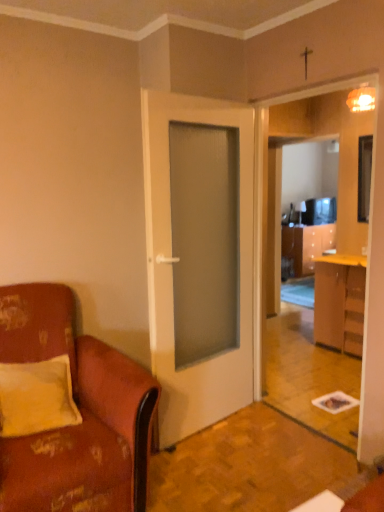
Measure the distance between point (50,403) and camera.

Point (50,403) and camera are 6.69 feet apart.

What do you see at coordinates (364, 176) in the screenshot?
I see `black glossy television at right` at bounding box center [364, 176].

Find the location of `white matte door at center`. white matte door at center is located at coordinates (171, 271).

Consider the image. Is yellow fabric pillow at left taller or shorter than black glossy television at right?

Clearly, yellow fabric pillow at left is shorter compared to black glossy television at right.

Is black glossy television at right at the back of yellow fabric pillow at left?

No.

Is yellow fabric pillow at left next to black glossy television at right and touching it?

No, yellow fabric pillow at left is not in contact with black glossy television at right.

How different are the orientations of yellow fabric pillow at left and black glossy television at right in degrees?

There is a 80.4-degree angle between the facing directions of yellow fabric pillow at left and black glossy television at right.

Are leather at left and wooden cabinet at right far apart?

Yes.

Is leather at left facing towards wooden cabinet at right?

No, leather at left is not facing towards wooden cabinet at right.

Between leather at left and wooden cabinet at right, which one has smaller width?

wooden cabinet at right.

Which of these two, leather at left or wooden cabinet at right, is smaller?

With smaller size is wooden cabinet at right.

Between black glossy television at right and yellow fabric pillow at left, which one appears on the right side from the viewer's perspective?

black glossy television at right is more to the right.

From the image's perspective, is black glossy television at right on yellow fabric pillow at left?

Yes.

Is there a large distance between black glossy television at right and yellow fabric pillow at left?

Indeed, black glossy television at right is not near yellow fabric pillow at left.

Which is more distant, (354,319) or (139,403)?

Positioned behind is point (354,319).

Does wooden cabinet at right have a greater width compared to leather at left?

No, wooden cabinet at right is not wider than leather at left.

Is wooden cabinet at right not within leather at left?

That's correct, wooden cabinet at right is outside of leather at left.

Identify the location of cabinetry on the right side of leather at left. (340, 302).

Is white matte door at center at the right side of wooden cabinet at right?

In fact, white matte door at center is to the left of wooden cabinet at right.

Is white matte door at center positioned with its back to wooden cabinet at right?

That's not correct — white matte door at center is not looking away from wooden cabinet at right.

From the image's perspective, which is below, white matte door at center or wooden cabinet at right?

wooden cabinet at right, from the image's perspective.

In terms of height, does white matte door at center look taller or shorter compared to wooden cabinet at right?

white matte door at center is taller than wooden cabinet at right.

Can you confirm if wooden cabinet at right is positioned to the left of yellow fabric pillow at left?

No.

Looking at this image, based on their sizes in the image, would you say wooden cabinet at right is bigger or smaller than yellow fabric pillow at left?

In the image, wooden cabinet at right appears to be larger than yellow fabric pillow at left.

Considering the relative sizes of wooden cabinet at right and yellow fabric pillow at left in the image provided, is wooden cabinet at right taller than yellow fabric pillow at left?

Indeed, wooden cabinet at right has a greater height compared to yellow fabric pillow at left.

Is wooden cabinet at right next to yellow fabric pillow at left?

No, wooden cabinet at right is not beside yellow fabric pillow at left.

Considering the sizes of objects black glossy television at right and white matte door at center in the image provided, who is bigger, black glossy television at right or white matte door at center?

white matte door at center is bigger.

Is black glossy television at right outside of white matte door at center?

That's correct, black glossy television at right is outside of white matte door at center.

Between black glossy television at right and white matte door at center, which one appears on the left side from the viewer's perspective?

white matte door at center is more to the left.

Find the location of a particular element. This screenshot has height=512, width=384. pillow below the black glossy television at right (from the image's perspective) is located at coordinates (36, 397).

Find the location of a particular element. chair on the left of wooden cabinet at right is located at coordinates (79, 410).

Estimate the real-world distances between objects in this image. Which object is closer to yellow fabric pillow at left, leather at left or black glossy television at right?

The object closer to yellow fabric pillow at left is leather at left.

Considering their positions, is wooden cabinet at right positioned closer to leather at left than yellow fabric pillow at left?

yellow fabric pillow at left lies closer to leather at left than the other object.

Which object lies further to the anchor point yellow fabric pillow at left, leather at left or wooden cabinet at right?

wooden cabinet at right lies further to yellow fabric pillow at left than the other object.

Considering their positions, is wooden cabinet at right positioned further to white matte door at center than leather at left?

Among the two, wooden cabinet at right is located further to white matte door at center.

Estimate the real-world distances between objects in this image. Which object is closer to wooden cabinet at right, black glossy television at right or leather at left?

black glossy television at right.

Which object lies nearer to the anchor point leather at left, yellow fabric pillow at left or wooden cabinet at right?

Based on the image, yellow fabric pillow at left appears to be nearer to leather at left.

Considering their positions, is white matte door at center positioned further to leather at left than yellow fabric pillow at left?

white matte door at center is positioned further to the anchor leather at left.

Based on their spatial positions, is yellow fabric pillow at left or white matte door at center further from leather at left?

white matte door at center lies further to leather at left than the other object.

Locate an element on the screen. door between leather at left and wooden cabinet at right along the z-axis is located at coordinates (171, 271).

Where is `door between leather at left and black glossy television at right in the front-back direction`? This screenshot has width=384, height=512. door between leather at left and black glossy television at right in the front-back direction is located at coordinates (171, 271).

Image resolution: width=384 pixels, height=512 pixels. Find the location of `chair between yellow fabric pillow at left and black glossy television at right`. chair between yellow fabric pillow at left and black glossy television at right is located at coordinates (79, 410).

Image resolution: width=384 pixels, height=512 pixels. I want to click on cabinetry between leather at left and black glossy television at right in the front-back direction, so click(x=340, y=302).